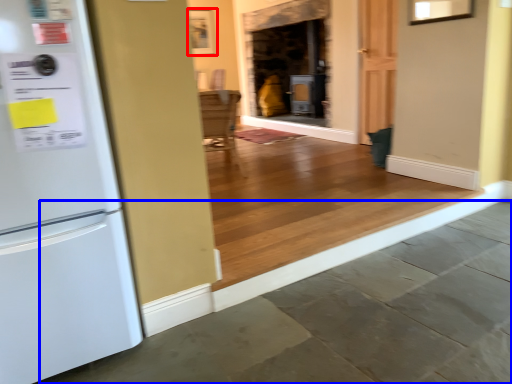
Question: Which point is closer to the camera, picture frame (highlighted by a red box) or concrete (highlighted by a blue box)?

Choices:
 (A) picture frame
 (B) concrete

Answer: (B)